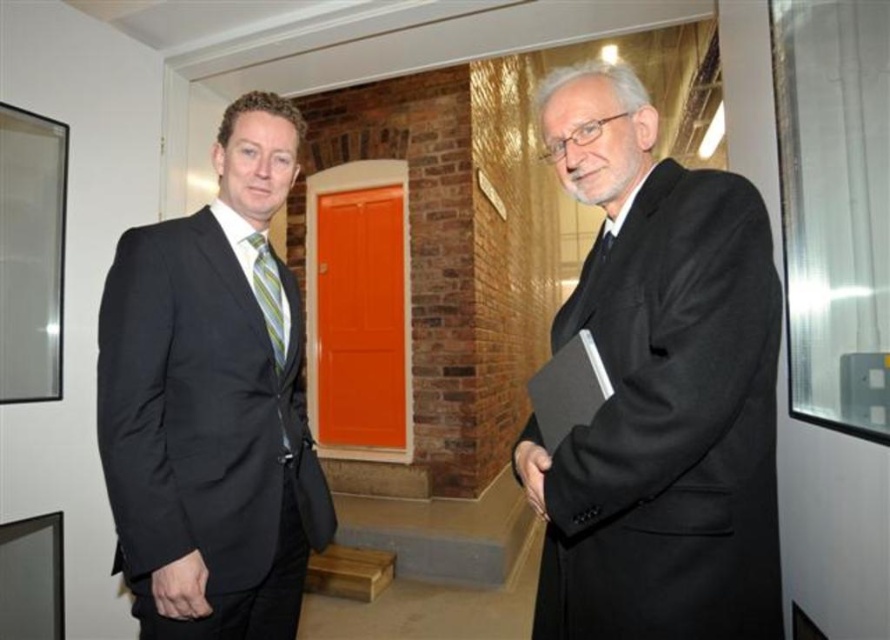
Between point (182, 580) and point (257, 250), which one is positioned in front?

Positioned in front is point (182, 580).

Is point (168, 582) positioned behind point (274, 312)?

No, it is in front of (274, 312).

What do you see at coordinates (181, 588) in the screenshot?
I see `black smooth hand at lower left` at bounding box center [181, 588].

I want to click on black smooth hand at lower left, so click(x=181, y=588).

Does black suit at left have a smaller size compared to black smooth hand at lower left?

No.

Is black suit at left thinner than black smooth hand at lower left?

No, black suit at left is not thinner than black smooth hand at lower left.

You are a GUI agent. You are given a task and a screenshot of the screen. Output one action in this format:
    pyautogui.click(x=<x>, y=<y>)
    Task: Click on the black suit at left
    The image size is (890, 640).
    Given the screenshot: What is the action you would take?
    pyautogui.click(x=211, y=397)

Between point (627, 115) and point (527, 472), which one is positioned in front?

Point (527, 472) is in front.

Between black matte suit at center and smooth black hand at right, which one appears on the left side from the viewer's perspective?

From the viewer's perspective, smooth black hand at right appears more on the left side.

What do you see at coordinates (661, 387) in the screenshot? This screenshot has height=640, width=890. I see `black matte suit at center` at bounding box center [661, 387].

Where is `black matte suit at center`? The width and height of the screenshot is (890, 640). black matte suit at center is located at coordinates (661, 387).